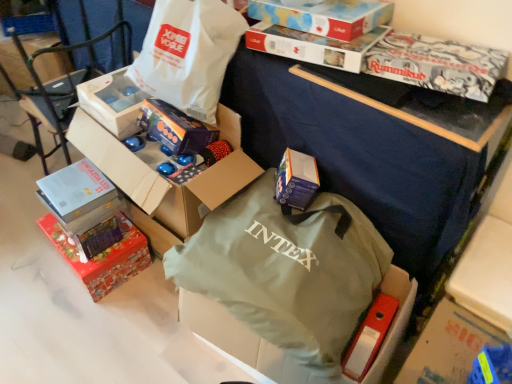
This screenshot has width=512, height=384. Identify the location of vacant space to the left of red glossy gift box at lower left, which appears as the 5th box when viewed from the top. (30, 261).